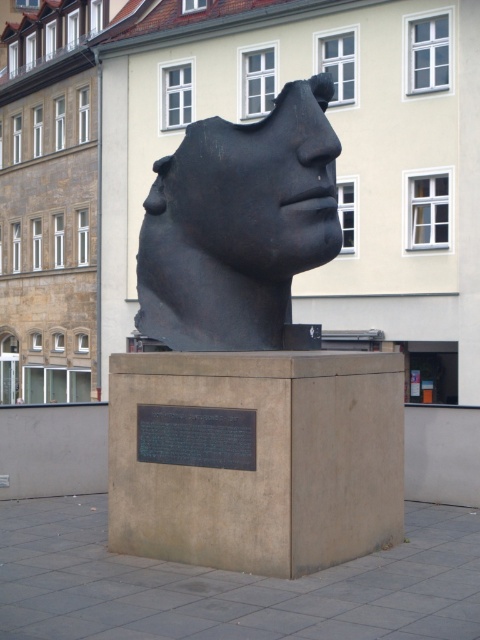
Question: Does black matte head at center have a smaller size compared to black matte sculpture at center?

Choices:
 (A) no
 (B) yes

Answer: (A)

Question: Which object appears farthest from the camera in this image?

Choices:
 (A) black matte head at center
 (B) black matte sculpture at center

Answer: (B)

Question: In this image, where is black matte head at center located relative to black matte sculpture at center?

Choices:
 (A) below
 (B) above

Answer: (A)

Question: Is black matte head at center positioned at the back of black matte sculpture at center?

Choices:
 (A) no
 (B) yes

Answer: (A)